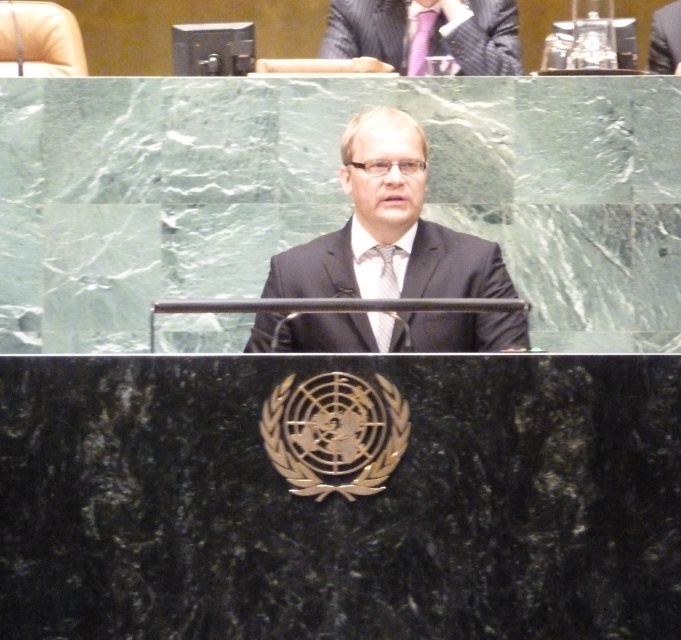
Question: Based on their relative distances, which object is nearer to the black suit at center?

Choices:
 (A) matte silver tie at center
 (B) matte black suit at upper center
 (C) purple satin tie at upper center

Answer: (A)

Question: Which point appears closest to the camera in this image?

Choices:
 (A) (317, 237)
 (B) (464, 44)
 (C) (434, 19)
 (D) (373, 252)

Answer: (D)

Question: Observing the image, what is the correct spatial positioning of black suit at center in reference to purple satin tie at upper center?

Choices:
 (A) left
 (B) right

Answer: (A)

Question: In this image, where is matte black suit at upper center located relative to purple satin tie at upper center?

Choices:
 (A) below
 (B) above

Answer: (B)

Question: Among these points, which one is farthest from the camera?

Choices:
 (A) (355, 26)
 (B) (477, 292)

Answer: (A)

Question: Is matte silver tie at center thinner than purple satin tie at upper center?

Choices:
 (A) yes
 (B) no

Answer: (B)